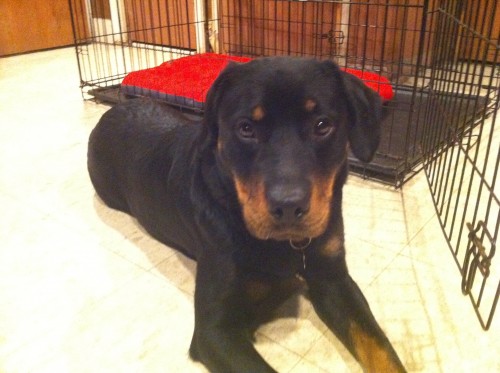
This screenshot has height=373, width=500. Identify the location of dog bed. (185, 88).